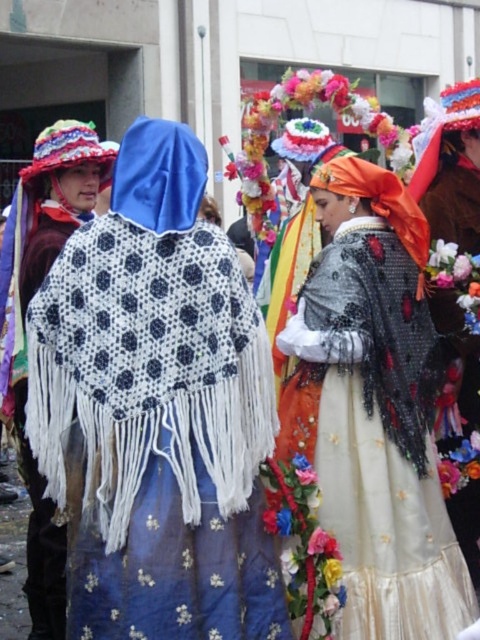
Question: Which object appears closest to the camera in this image?

Choices:
 (A) shiny orange fabric at center
 (B) white knitted shawl at left
 (C) floral lace dress at center
 (D) white knitted shawl at center

Answer: (D)

Question: Which object is farther from the camera taking this photo?

Choices:
 (A) floral lace dress at center
 (B) white knitted shawl at center
 (C) shiny orange fabric at center
 (D) white knitted shawl at left

Answer: (A)

Question: In this image, where is shiny orange fabric at center located relative to white knitted shawl at left?

Choices:
 (A) right
 (B) left

Answer: (A)

Question: Which object is closer to the camera taking this photo?

Choices:
 (A) floral lace dress at center
 (B) white knitted shawl at left

Answer: (B)

Question: Is white knitted shawl at left wider than floral lace dress at center?

Choices:
 (A) yes
 (B) no

Answer: (A)

Question: Is white knitted shawl at center above floral lace dress at center?

Choices:
 (A) no
 (B) yes

Answer: (A)